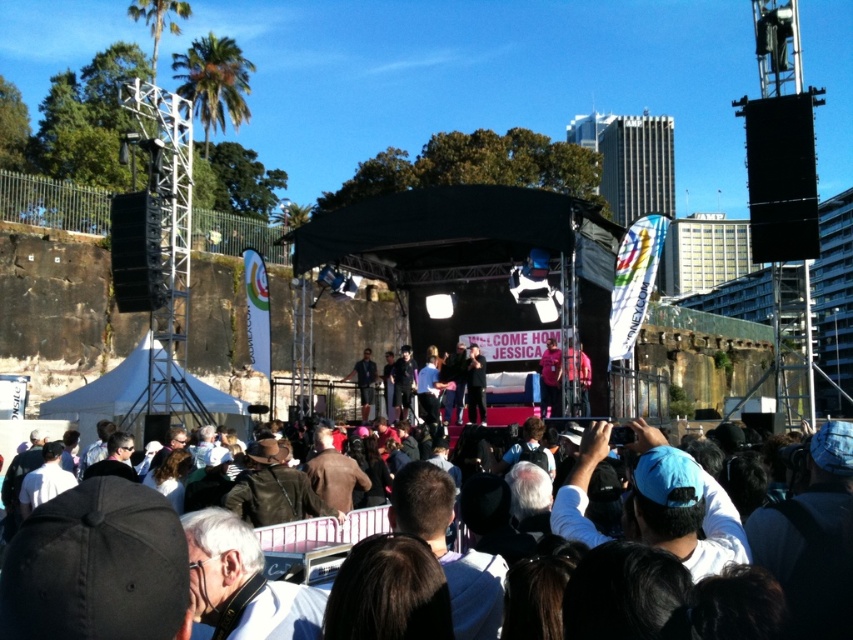
You are an event photographer positioned at the front of the crowd. You notice the dark brown leather jacket at center and the pink fabric at stage center in your viewfinder. Which object is closer to you?

The dark brown leather jacket at center is closer to you because it is in front of the pink fabric at stage center.

You are standing at the point labeled point (544,349) and want to move to the stage. There is a person at point (846,609) blocking your path. Can you walk around them to reach the stage?

Point (846,609) is in front of point (544,349), so the person blocking your path is closer to the stage than you are. You can walk around them to reach the stage.